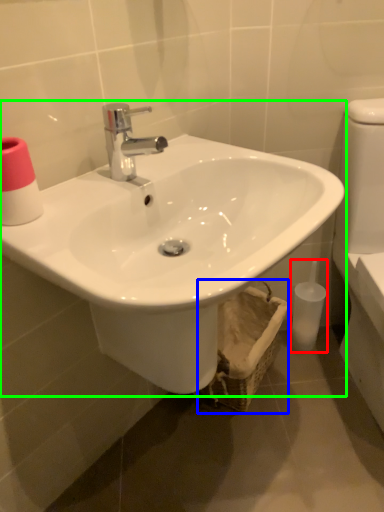
Question: Estimate the real-world distances between objects in this image. Which object is closer to toiletry (highlighted by a red box), basket (highlighted by a blue box) or sink (highlighted by a green box)?

Choices:
 (A) basket
 (B) sink

Answer: (A)